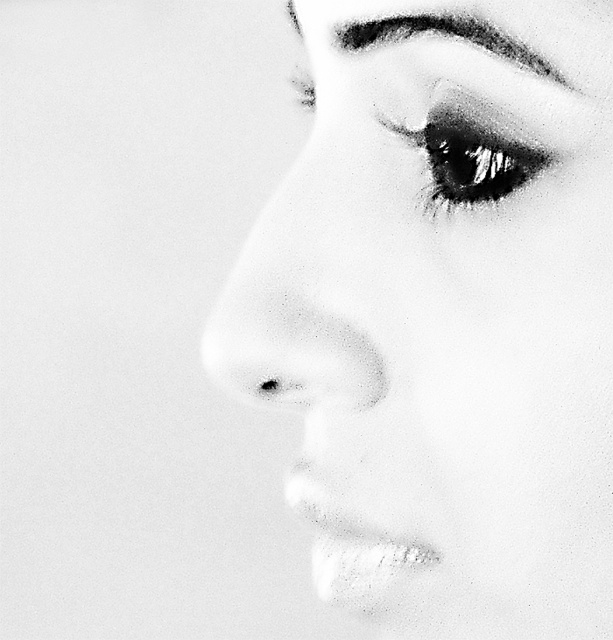
Is smooth skin face at upper right positioned behind shiny black eye at upper right?

No, smooth skin face at upper right is closer to the viewer.

This screenshot has height=640, width=613. I want to click on smooth skin face at upper right, so click(443, 314).

How much distance is there between smooth skin face at upper right and black textured eyebrow at upper center?

smooth skin face at upper right is 2.57 inches away from black textured eyebrow at upper center.

Locate an element on the screen. This screenshot has height=640, width=613. smooth skin face at upper right is located at coordinates [x=443, y=314].

Is point (503, 196) farther from viewer compared to point (392, 36)?

No, it is in front of (392, 36).

Does point (466, 184) lie in front of point (386, 24)?

Yes, it is.

In order to click on shiny black eye at upper right in this screenshot , I will do `click(473, 154)`.